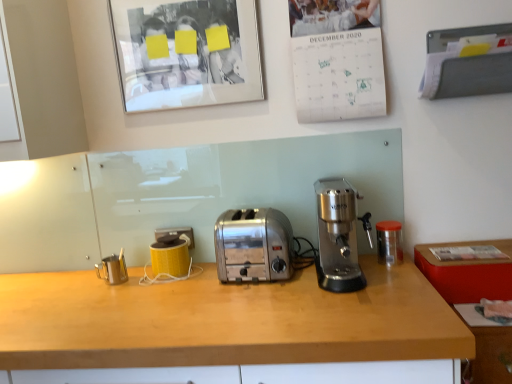
I want to click on free area in between satin chrome toaster at center and satin silver coffee maker at center, so click(289, 273).